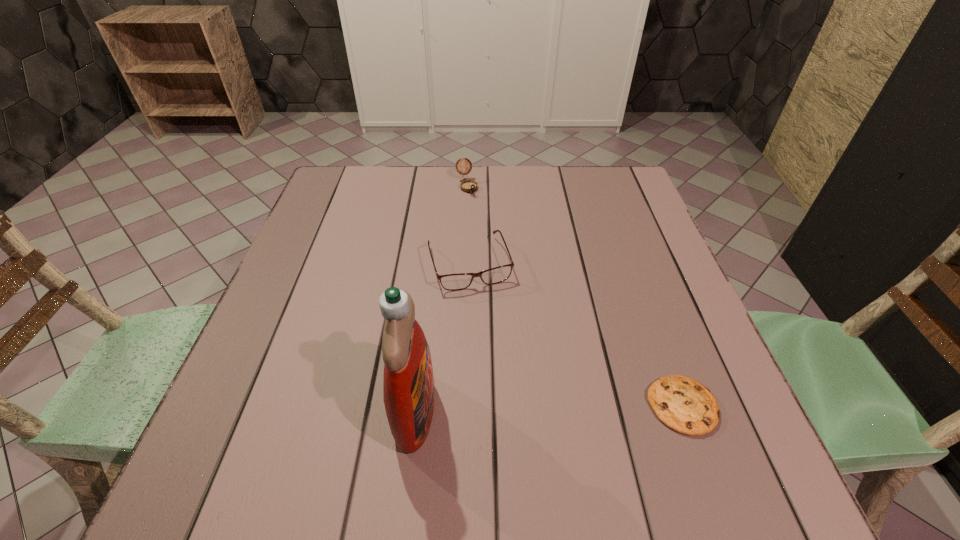
At what (x,y) coordinates should I click in order to perform the action: click on detergent. Please return your answer as a coordinate pair (x, y). This screenshot has height=540, width=960. Looking at the image, I should click on (408, 384).

The height and width of the screenshot is (540, 960). Identify the location of cookie. (683, 404).

What are the coordinates of `the shortest object` in the screenshot? It's located at click(x=683, y=404).

At what (x,y) coordinates should I click in order to perform the action: click on the second tallest object. Please return your answer as a coordinate pair (x, y). This screenshot has height=540, width=960. Looking at the image, I should click on (469, 186).

The height and width of the screenshot is (540, 960). Identify the location of compass. (469, 186).

Find the location of `spectacles`. spectacles is located at coordinates (452, 282).

Identify the location of the second shortest object. The height and width of the screenshot is (540, 960). (452, 282).

In order to click on free space located 0.240m on the front surface of the detergent in this screenshot , I will do `click(572, 410)`.

Identify the location of free space located 0.200m on the back of the cookie. This screenshot has width=960, height=540. (644, 300).

Find the location of a particular element. The image size is (960, 540). free spot located 0.330m on the face of the second tallest object is located at coordinates (508, 273).